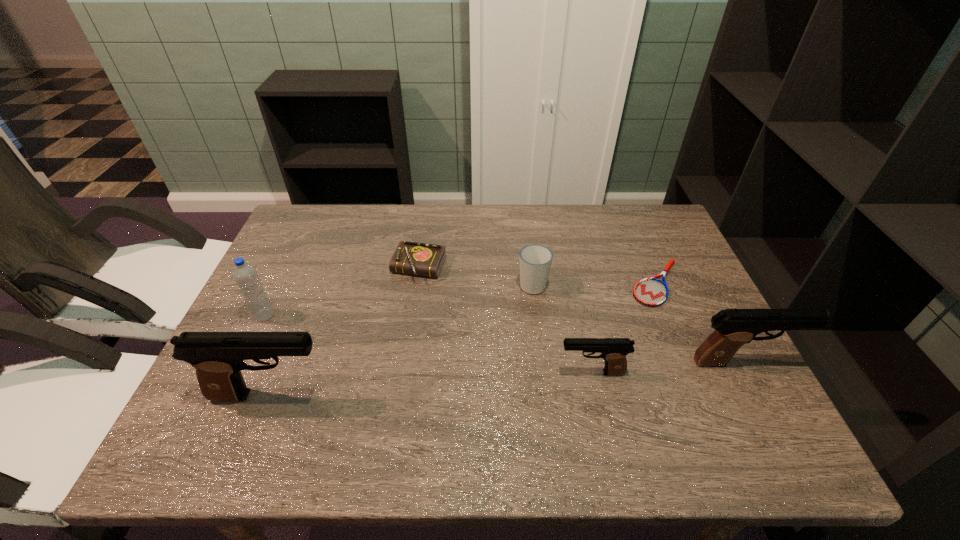
In order to click on the leftmost pistol in this screenshot , I will do `click(218, 357)`.

Locate an element on the screen. The image size is (960, 540). the nearest pistol is located at coordinates (218, 357).

Identify the location of the shortest pistol. (614, 350).

You are a GUI agent. You are given a task and a screenshot of the screen. Output one action in this format:
    pyautogui.click(x=<x>, y=<y>)
    Task: Click on the second tallest pistol
    The width and height of the screenshot is (960, 540).
    Given the screenshot: What is the action you would take?
    pyautogui.click(x=735, y=327)

The width and height of the screenshot is (960, 540). I want to click on tennis racket, so click(652, 292).

In order to click on the fourth farthest object in this screenshot , I will do `click(245, 275)`.

Where is `the second shortest object`? the second shortest object is located at coordinates (421, 259).

The image size is (960, 540). I want to click on the third object from left to right, so click(x=421, y=259).

Find the location of a particular element. Image resolution: width=960 pixels, height=540 pixels. cup is located at coordinates (535, 260).

What are the coordinates of `blank space located at the barrel of the leftmost pistol` in the screenshot? It's located at (470, 395).